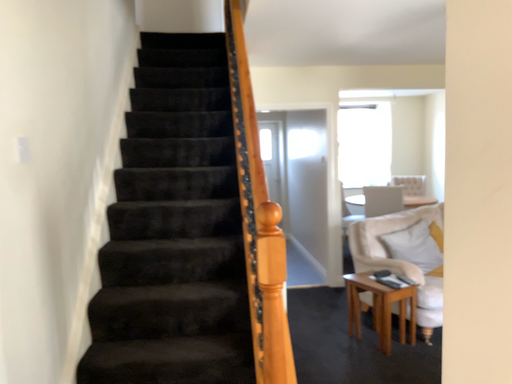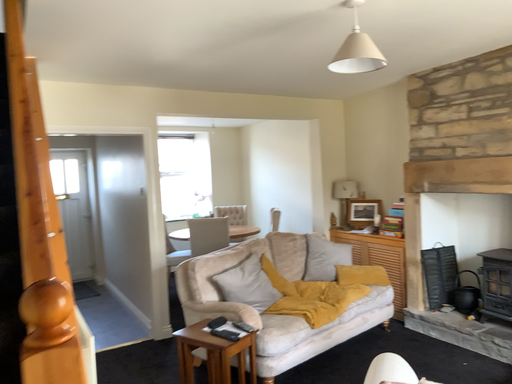
Question: Which way did the camera rotate in the video?

Choices:
 (A) rotated right
 (B) rotated left

Answer: (A)